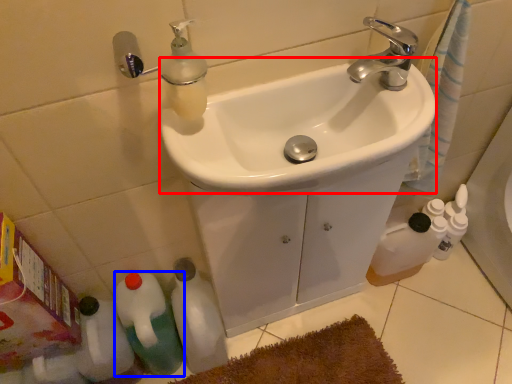
Question: Among these objects, which one is nearest to the camera, sink (highlighted by a red box) or bottle (highlighted by a blue box)?

Choices:
 (A) sink
 (B) bottle

Answer: (A)